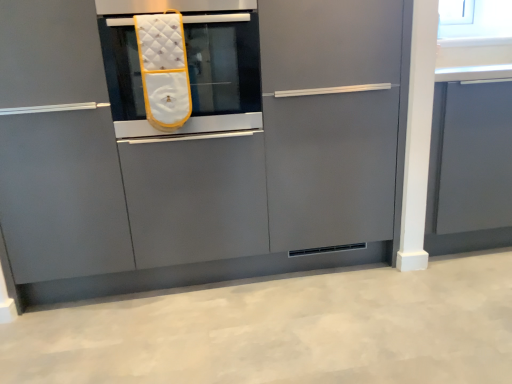
Question: Is matte gray cabinet at center, which is the second cabinetry in right-to-left order, at the left side of white quilted oven mitt at center?

Choices:
 (A) yes
 (B) no

Answer: (B)

Question: Is matte gray cabinet at center, which is the second cabinetry in right-to-left order, not near white quilted oven mitt at center?

Choices:
 (A) no
 (B) yes

Answer: (A)

Question: Does matte gray cabinet at center, which is the second cabinetry in right-to-left order, have a lesser height compared to white quilted oven mitt at center?

Choices:
 (A) no
 (B) yes

Answer: (A)

Question: From a real-world perspective, is matte gray cabinet at center, which is the second cabinetry in right-to-left order, below white quilted oven mitt at center?

Choices:
 (A) yes
 (B) no

Answer: (A)

Question: From a real-world perspective, is matte gray cabinet at center, the first cabinetry from the left, located higher than white quilted oven mitt at center?

Choices:
 (A) yes
 (B) no

Answer: (B)

Question: Could you tell me if matte gray cabinet at center, which is the second cabinetry in right-to-left order, is facing white quilted oven mitt at center?

Choices:
 (A) no
 (B) yes

Answer: (B)

Question: Considering the relative sizes of matte gray cabinet at right, the 2th cabinetry positioned from the left, and white quilted oven mitt at center in the image provided, is matte gray cabinet at right, the 2th cabinetry positioned from the left, wider than white quilted oven mitt at center?

Choices:
 (A) yes
 (B) no

Answer: (B)

Question: Is matte gray cabinet at right, the 2th cabinetry positioned from the left, positioned before white quilted oven mitt at center?

Choices:
 (A) no
 (B) yes

Answer: (A)

Question: From a real-world perspective, is matte gray cabinet at right, marked as the first cabinetry in a right-to-left arrangement, positioned over white quilted oven mitt at center based on gravity?

Choices:
 (A) no
 (B) yes

Answer: (A)

Question: From a real-world perspective, is matte gray cabinet at right, marked as the first cabinetry in a right-to-left arrangement, positioned under white quilted oven mitt at center based on gravity?

Choices:
 (A) yes
 (B) no

Answer: (A)

Question: Could white quilted oven mitt at center be considered to be inside matte gray cabinet at right, marked as the first cabinetry in a right-to-left arrangement?

Choices:
 (A) yes
 (B) no

Answer: (B)

Question: Can you confirm if matte gray cabinet at right, marked as the first cabinetry in a right-to-left arrangement, is thinner than white quilted oven mitt at center?

Choices:
 (A) no
 (B) yes

Answer: (B)

Question: Considering the relative sizes of white quilted oven mitt at center and matte gray cabinet at center, the first cabinetry from the left, in the image provided, is white quilted oven mitt at center shorter than matte gray cabinet at center, the first cabinetry from the left,?

Choices:
 (A) yes
 (B) no

Answer: (A)